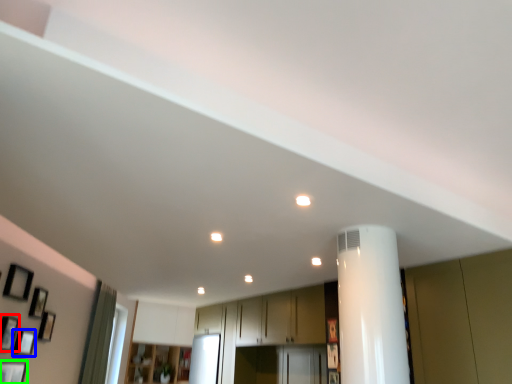
Question: Which object is positioned farthest from picture frame (highlighted by a red box)? Select from picture frame (highlighted by a blue box) and picture frame (highlighted by a green box).

Choices:
 (A) picture frame
 (B) picture frame

Answer: (B)